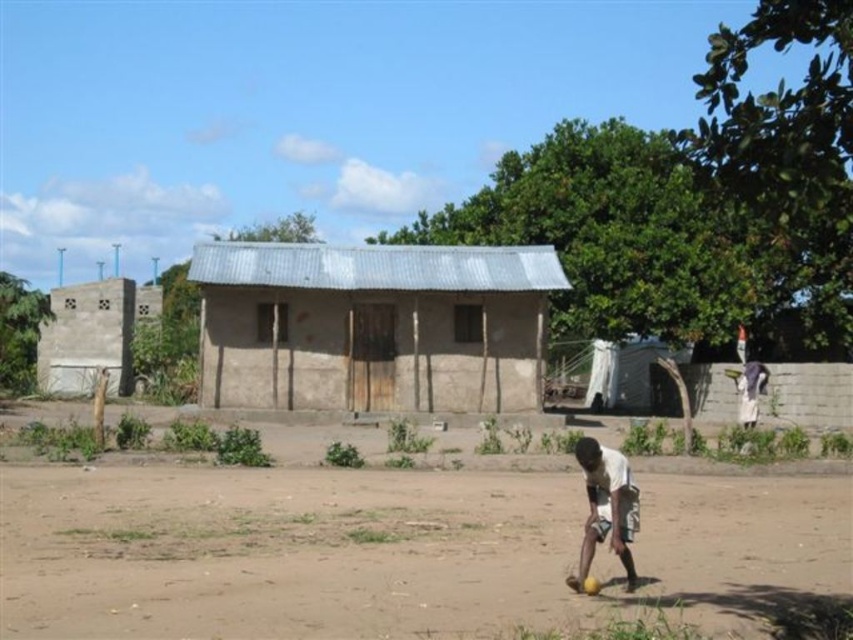
Is point (148, 486) less distant than point (91, 323)?

Yes, point (148, 486) is in front of point (91, 323).

Does brown sandy dirt field at lower center appear on the left side of gray concrete wall at left?

In fact, brown sandy dirt field at lower center is to the right of gray concrete wall at left.

What do you see at coordinates (392, 550) in the screenshot? This screenshot has width=853, height=640. I see `brown sandy dirt field at lower center` at bounding box center [392, 550].

I want to click on brown sandy dirt field at lower center, so click(x=392, y=550).

Can you confirm if gray concrete wall at left is thinner than white matte shirt at lower center?

Incorrect, gray concrete wall at left's width is not less than white matte shirt at lower center's.

What do you see at coordinates (91, 333) in the screenshot? The image size is (853, 640). I see `gray concrete wall at left` at bounding box center [91, 333].

Who is more forward, [67,378] or [604,496]?

Point [604,496]

This screenshot has width=853, height=640. Identify the location of gray concrete wall at left. (91, 333).

Can you confirm if brown sandy dirt field at lower center is thinner than white matte shirt at lower center?

In fact, brown sandy dirt field at lower center might be wider than white matte shirt at lower center.

Can you confirm if brown sandy dirt field at lower center is shorter than white matte shirt at lower center?

Yes, brown sandy dirt field at lower center is shorter than white matte shirt at lower center.

Which is behind, point (187, 518) or point (628, 557)?

The point (187, 518) is more distant.

In order to click on brown sandy dirt field at lower center in this screenshot , I will do [392, 550].